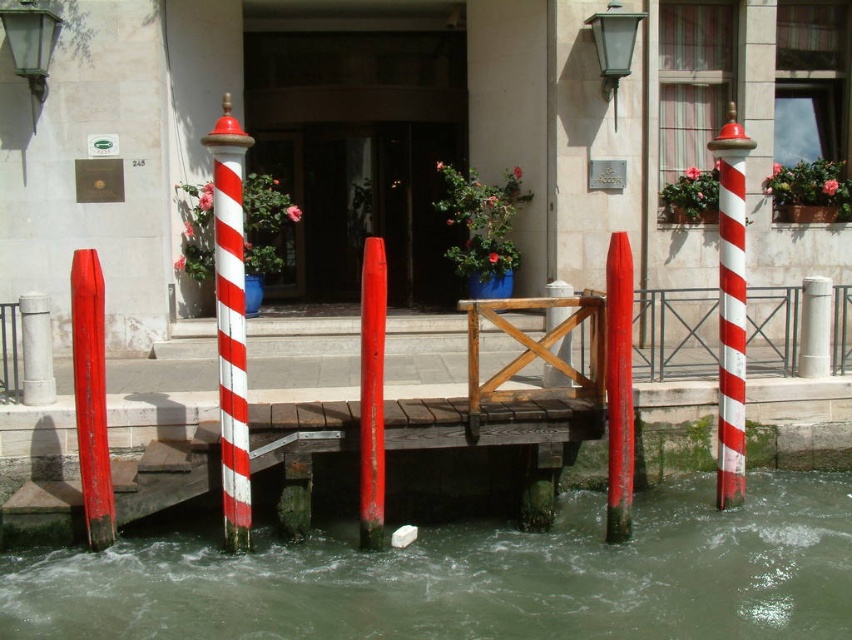
You are standing on the dock and want to walk from point A to point B. Point A is at coordinates point (735, 276) and point B is at coordinates point (373, 324). Which direction should you walk to move from point A to point B?

To move from point A at coordinates point (735, 276) to point B at coordinates point (373, 324), you should walk forward since point A is behind point B.

You are standing on the dock and want to see where the greenish murky water at lower center is located. According to the coordinates provided, which direction should you look to find it?

The greenish murky water at lower center is located at coordinates point (475, 577), so you should look towards the lower center direction to find it.

Based on the photo, you are a painter who needs to choose between two red structures on the dock to paint. The red striped pole at right and the smooth red post at center. Which one has a wider base?

The red striped pole at right has a wider base than the smooth red post at center because its width is larger according to the description.